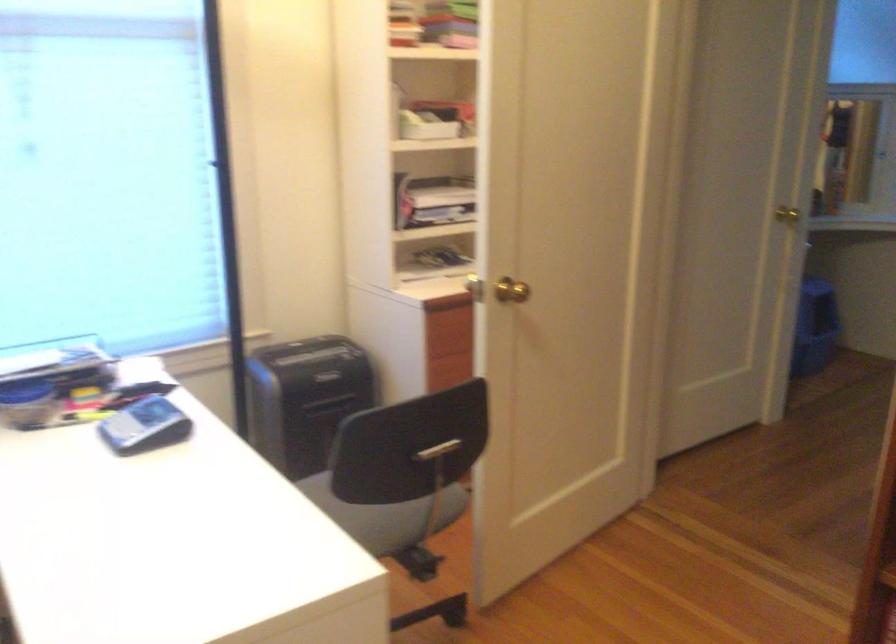
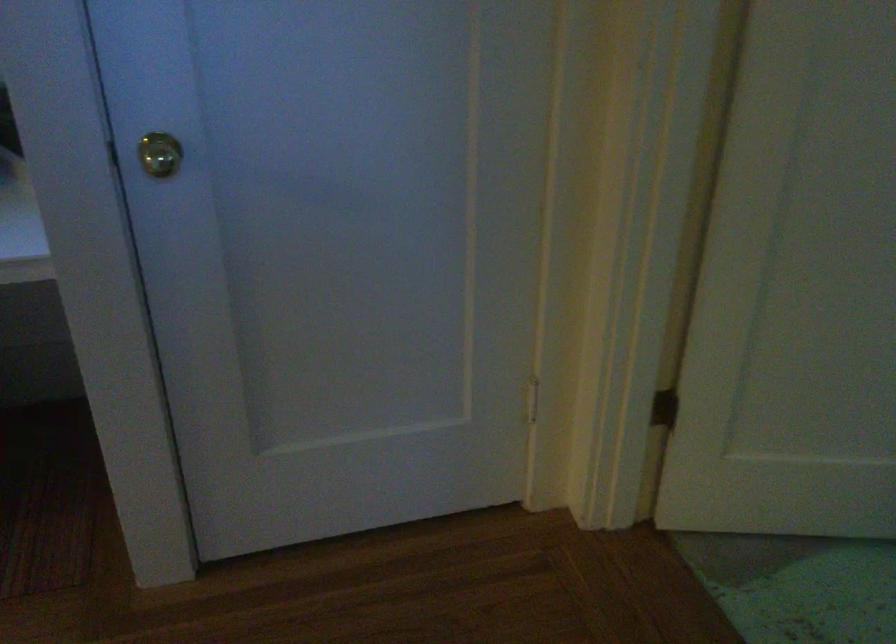
Based on the photo, what movement of the cameraman would produce the second image?

The movement direction of the cameraman is right, forward.